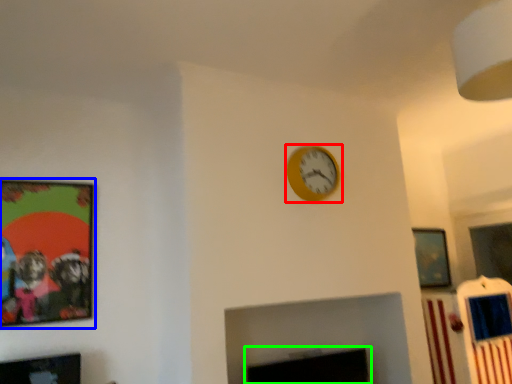
Question: Considering the real-world distances, which object is farthest from wall clock (highlighted by a red box)? picture frame (highlighted by a blue box) or fireplace (highlighted by a green box)?

Choices:
 (A) picture frame
 (B) fireplace

Answer: (A)